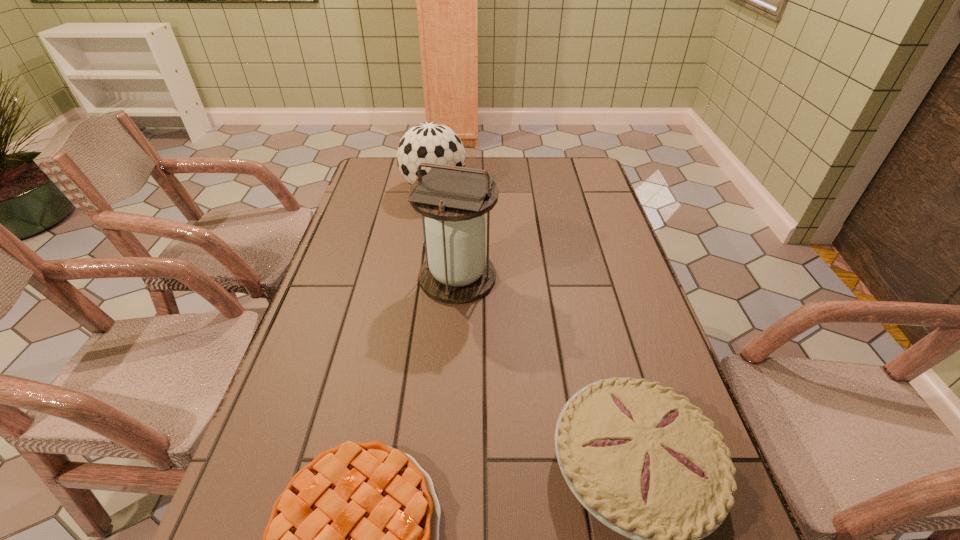
This screenshot has width=960, height=540. Find the location of `the tallest object`. the tallest object is located at coordinates (453, 199).

The width and height of the screenshot is (960, 540). I want to click on the second farthest object, so click(x=453, y=199).

This screenshot has height=540, width=960. Find the location of `the second tallest object`. the second tallest object is located at coordinates (430, 142).

Locate an element on the screen. the farthest object is located at coordinates (430, 142).

You are a GUI agent. You are given a task and a screenshot of the screen. Output one action in this format:
    pyautogui.click(x=<x>, y=<y>)
    Task: Click on the free space located 0.340m on the front of the lantern
    
    Given the screenshot: What is the action you would take?
    pyautogui.click(x=448, y=437)

The image size is (960, 540). Find the location of `free region located 0.110m on the right of the soccer ball`. free region located 0.110m on the right of the soccer ball is located at coordinates (499, 188).

At what (x,y) coordinates should I click in order to perform the action: click on object that is at the far edge. Please return your answer as a coordinate pair (x, y). This screenshot has height=540, width=960. Looking at the image, I should click on (430, 142).

You are a GUI agent. You are given a task and a screenshot of the screen. Output one action in this format:
    pyautogui.click(x=<x>, y=<y>)
    Task: Click on the object situated at the left edge
    This screenshot has height=540, width=960.
    Given the screenshot: What is the action you would take?
    pyautogui.click(x=430, y=142)

Find the location of a particular element. The height and width of the screenshot is (540, 960). object that is positioned at the far left corner is located at coordinates (430, 142).

In the image, there is a desktop. Where is `free space at the far edge`? The image size is (960, 540). free space at the far edge is located at coordinates (469, 163).